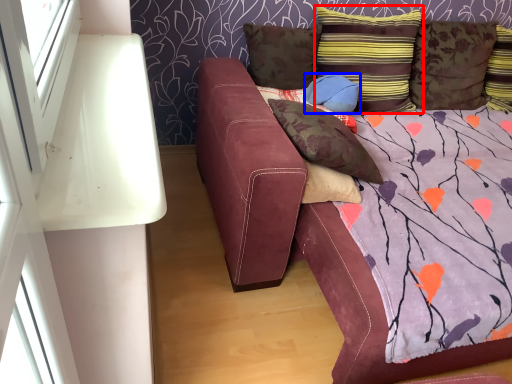
Question: Among these objects, which one is nearest to the camera, pillow (highlighted by a red box) or pillow (highlighted by a blue box)?

Choices:
 (A) pillow
 (B) pillow

Answer: (A)